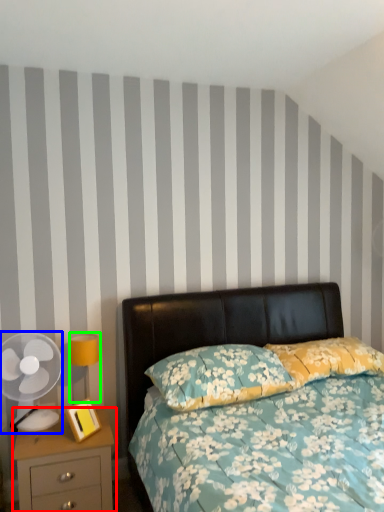
Question: Based on their relative distances, which object is nearer to nightstand (highlighted by a red box)? Choose from mechanical fan (highlighted by a blue box) and bedside lamp (highlighted by a green box).

Choices:
 (A) mechanical fan
 (B) bedside lamp

Answer: (A)